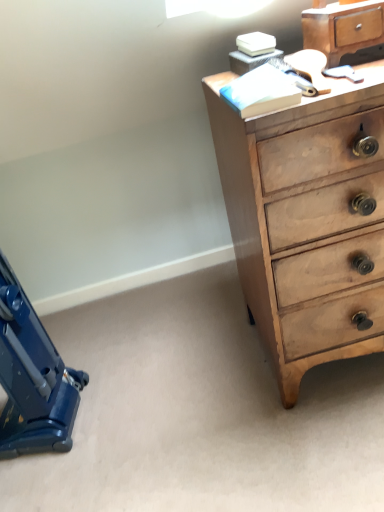
Question: From a real-world perspective, is blue plastic vacuum cleaner at lower left located beneath light brown wood chest of drawers at upper right?

Choices:
 (A) yes
 (B) no

Answer: (A)

Question: Is blue plastic vacuum cleaner at lower left facing towards light brown wood chest of drawers at upper right?

Choices:
 (A) yes
 (B) no

Answer: (A)

Question: Is blue plastic vacuum cleaner at lower left facing away from light brown wood chest of drawers at upper right?

Choices:
 (A) yes
 (B) no

Answer: (B)

Question: Is blue plastic vacuum cleaner at lower left wider than light brown wood chest of drawers at upper right?

Choices:
 (A) no
 (B) yes

Answer: (A)

Question: Is light brown wood chest of drawers at upper right located within blue plastic vacuum cleaner at lower left?

Choices:
 (A) yes
 (B) no

Answer: (B)

Question: From the image's perspective, is wooden chest of drawers at upper right above or below light brown wood chest of drawers at upper right?

Choices:
 (A) below
 (B) above

Answer: (B)

Question: Which is correct: wooden chest of drawers at upper right is inside light brown wood chest of drawers at upper right, or outside of it?

Choices:
 (A) inside
 (B) outside

Answer: (B)

Question: In the image, is wooden chest of drawers at upper right positioned in front of or behind light brown wood chest of drawers at upper right?

Choices:
 (A) front
 (B) behind

Answer: (B)

Question: In the image, is wooden chest of drawers at upper right on the left side or the right side of light brown wood chest of drawers at upper right?

Choices:
 (A) left
 (B) right

Answer: (A)

Question: From the image's perspective, is blue plastic vacuum cleaner at lower left located above or below wooden chest of drawers at upper right?

Choices:
 (A) above
 (B) below

Answer: (B)

Question: Looking at their shapes, would you say blue plastic vacuum cleaner at lower left is wider or thinner than wooden chest of drawers at upper right?

Choices:
 (A) wide
 (B) thin

Answer: (A)

Question: From their relative heights in the image, would you say blue plastic vacuum cleaner at lower left is taller or shorter than wooden chest of drawers at upper right?

Choices:
 (A) short
 (B) tall

Answer: (B)

Question: In terms of size, does blue plastic vacuum cleaner at lower left appear bigger or smaller than wooden chest of drawers at upper right?

Choices:
 (A) small
 (B) big

Answer: (B)

Question: Is point (243, 208) closer or farther from the camera than point (1, 275)?

Choices:
 (A) farther
 (B) closer

Answer: (B)

Question: Is light brown wood chest of drawers at upper right taller or shorter than blue plastic vacuum cleaner at lower left?

Choices:
 (A) short
 (B) tall

Answer: (B)